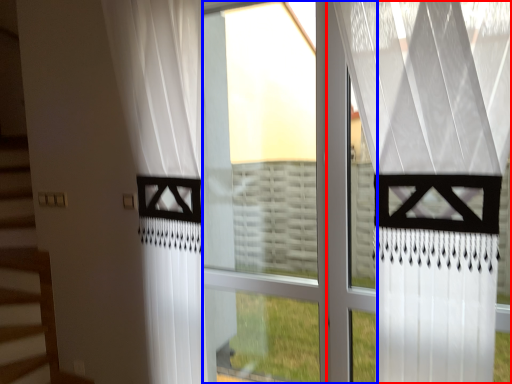
Question: Which object appears closest to the camera in this image, curtain (highlighted by a red box) or glass window (highlighted by a blue box)?

Choices:
 (A) curtain
 (B) glass window

Answer: (A)